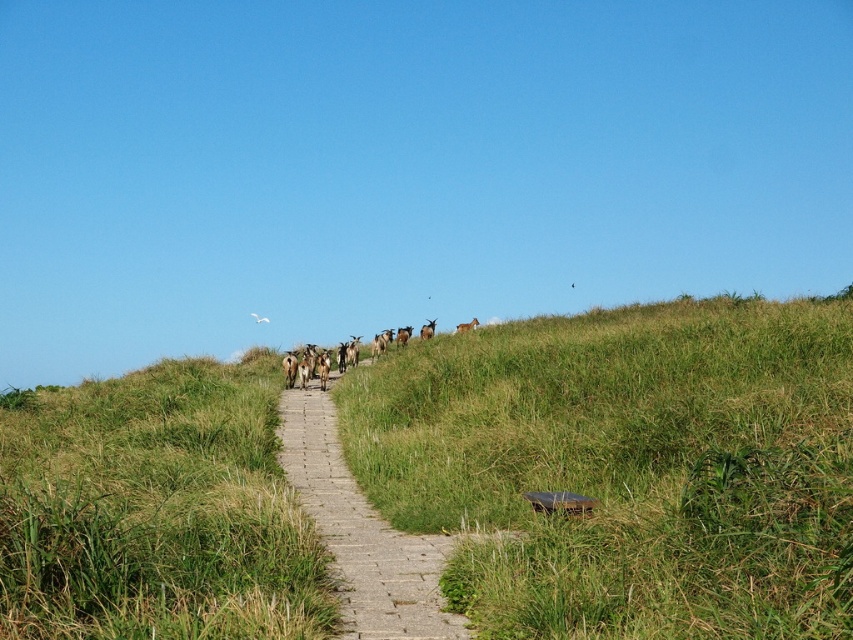
Question: Can you confirm if gray concrete path at center is bigger than brown furry goat at upper center?

Choices:
 (A) yes
 (B) no

Answer: (A)

Question: Does green grassy hillside at center appear over gray concrete path at center?

Choices:
 (A) no
 (B) yes

Answer: (B)

Question: Among these points, which one is farthest from the camera?

Choices:
 (A) (416, 636)
 (B) (518, 476)
 (C) (473, 320)

Answer: (C)

Question: Can you confirm if green grassy hillside at center is positioned below gray concrete path at center?

Choices:
 (A) yes
 (B) no

Answer: (B)

Question: Considering the real-world distances, which object is closest to the brown furry goat at upper center?

Choices:
 (A) gray concrete path at center
 (B) green grassy hillside at center

Answer: (A)

Question: Which of these objects is positioned closest to the gray concrete path at center?

Choices:
 (A) brown furry goat at upper center
 (B) green grassy hillside at center

Answer: (B)